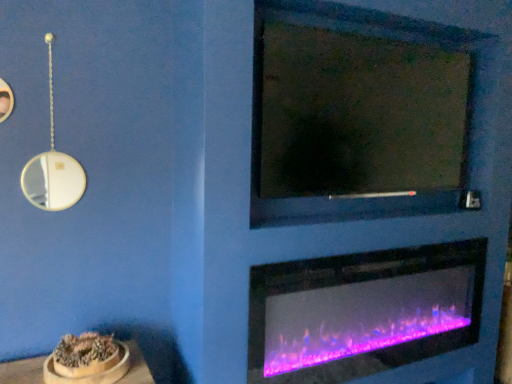
Question: Is purple glass fireplace at lower center aimed at matte glass mirror at upper center?

Choices:
 (A) no
 (B) yes

Answer: (A)

Question: Does purple glass fireplace at lower center have a greater height compared to matte glass mirror at upper center?

Choices:
 (A) yes
 (B) no

Answer: (B)

Question: Does purple glass fireplace at lower center have a greater width compared to matte glass mirror at upper center?

Choices:
 (A) yes
 (B) no

Answer: (B)

Question: From the image's perspective, does purple glass fireplace at lower center appear lower than matte glass mirror at upper center?

Choices:
 (A) no
 (B) yes

Answer: (B)

Question: Is matte glass mirror at upper center at the back of purple glass fireplace at lower center?

Choices:
 (A) yes
 (B) no

Answer: (B)

Question: From the image's perspective, is purple glass fireplace at lower center located above matte glass mirror at upper center?

Choices:
 (A) no
 (B) yes

Answer: (A)

Question: Is matte glass mirror at upper center far from purple glass fireplace at lower center?

Choices:
 (A) yes
 (B) no

Answer: (B)

Question: Does matte glass mirror at upper center have a lesser height compared to purple glass fireplace at lower center?

Choices:
 (A) no
 (B) yes

Answer: (A)

Question: Considering the relative positions of matte glass mirror at upper center and purple glass fireplace at lower center in the image provided, is matte glass mirror at upper center behind purple glass fireplace at lower center?

Choices:
 (A) yes
 (B) no

Answer: (B)

Question: Is matte glass mirror at upper center not inside purple glass fireplace at lower center?

Choices:
 (A) yes
 (B) no

Answer: (A)

Question: Is matte glass mirror at upper center wider than purple glass fireplace at lower center?

Choices:
 (A) no
 (B) yes

Answer: (B)

Question: Does matte glass mirror at upper center have a smaller size compared to purple glass fireplace at lower center?

Choices:
 (A) no
 (B) yes

Answer: (A)

Question: Considering the positions of point (284, 355) and point (297, 44), is point (284, 355) closer or farther from the camera than point (297, 44)?

Choices:
 (A) closer
 (B) farther

Answer: (B)